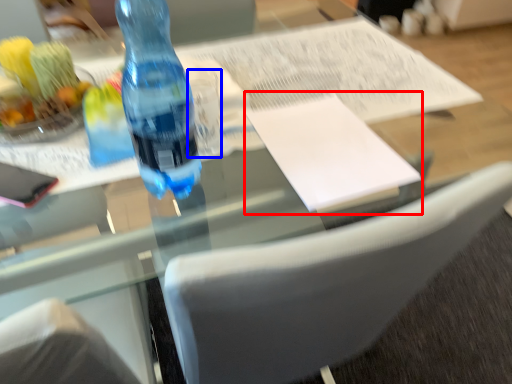
Question: Among these objects, which one is farthest to the camera, journal (highlighted by a red box) or clear (highlighted by a blue box)?

Choices:
 (A) journal
 (B) clear

Answer: (B)